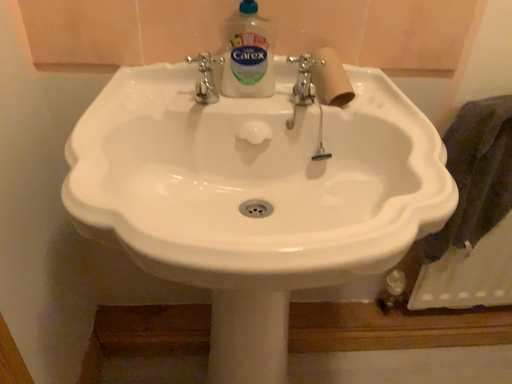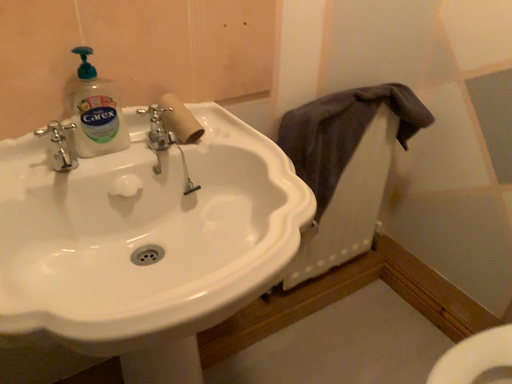
Question: Which way did the camera rotate in the video?

Choices:
 (A) rotated left
 (B) rotated right

Answer: (B)